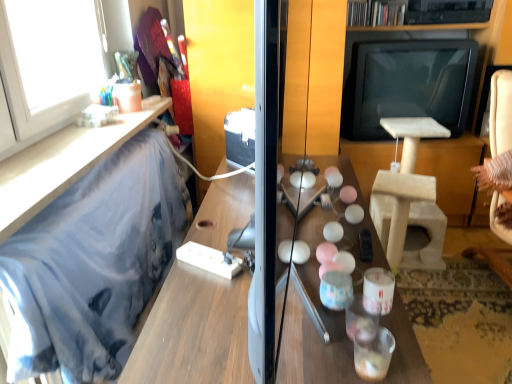
Question: Does beige fabric swivel chair at right appear on the right side of blue fabric at left, the second furniture in the bottom-to-top sequence?

Choices:
 (A) no
 (B) yes

Answer: (B)

Question: From the image's perspective, is beige fabric swivel chair at right located above blue fabric at left, the second furniture in the bottom-to-top sequence?

Choices:
 (A) yes
 (B) no

Answer: (B)

Question: Is beige fabric swivel chair at right located outside blue fabric at left, the second furniture in the bottom-to-top sequence?

Choices:
 (A) yes
 (B) no

Answer: (A)

Question: Can you confirm if beige fabric swivel chair at right is smaller than blue fabric at left, the first furniture from the top?

Choices:
 (A) no
 (B) yes

Answer: (A)

Question: Would you say beige fabric swivel chair at right contains blue fabric at left, the second furniture in the bottom-to-top sequence?

Choices:
 (A) yes
 (B) no

Answer: (B)

Question: From the image's perspective, is white glossy candle holder at center above or below blue fabric at left, the first furniture when ordered from bottom to top?

Choices:
 (A) below
 (B) above

Answer: (A)

Question: Is white glossy candle holder at center taller or shorter than blue fabric at left, the first furniture when ordered from bottom to top?

Choices:
 (A) short
 (B) tall

Answer: (A)

Question: Is point (387, 289) positioned closer to the camera than point (26, 206)?

Choices:
 (A) closer
 (B) farther

Answer: (A)

Question: Which is correct: white glossy candle holder at center is inside blue fabric at left, positioned as the 2th furniture in top-to-bottom order, or outside of it?

Choices:
 (A) outside
 (B) inside

Answer: (A)

Question: Considering the positions of point (384, 307) and point (58, 137), is point (384, 307) closer or farther from the camera than point (58, 137)?

Choices:
 (A) closer
 (B) farther

Answer: (A)

Question: From the image's perspective, relative to blue fabric at left, the second furniture in the bottom-to-top sequence, is white glossy candle holder at center above or below?

Choices:
 (A) above
 (B) below

Answer: (B)

Question: Considering the positions of white glossy candle holder at center and blue fabric at left, the second furniture in the bottom-to-top sequence, in the image, is white glossy candle holder at center bigger or smaller than blue fabric at left, the second furniture in the bottom-to-top sequence,?

Choices:
 (A) big
 (B) small

Answer: (B)

Question: From their relative heights in the image, would you say white glossy candle holder at center is taller or shorter than blue fabric at left, the second furniture in the bottom-to-top sequence?

Choices:
 (A) tall
 (B) short

Answer: (A)

Question: From the image's perspective, is white glossy window at upper left above or below blue fabric at left, positioned as the 2th furniture in top-to-bottom order?

Choices:
 (A) above
 (B) below

Answer: (A)

Question: Does point (69, 81) appear closer or farther from the camera than point (30, 208)?

Choices:
 (A) farther
 (B) closer

Answer: (A)